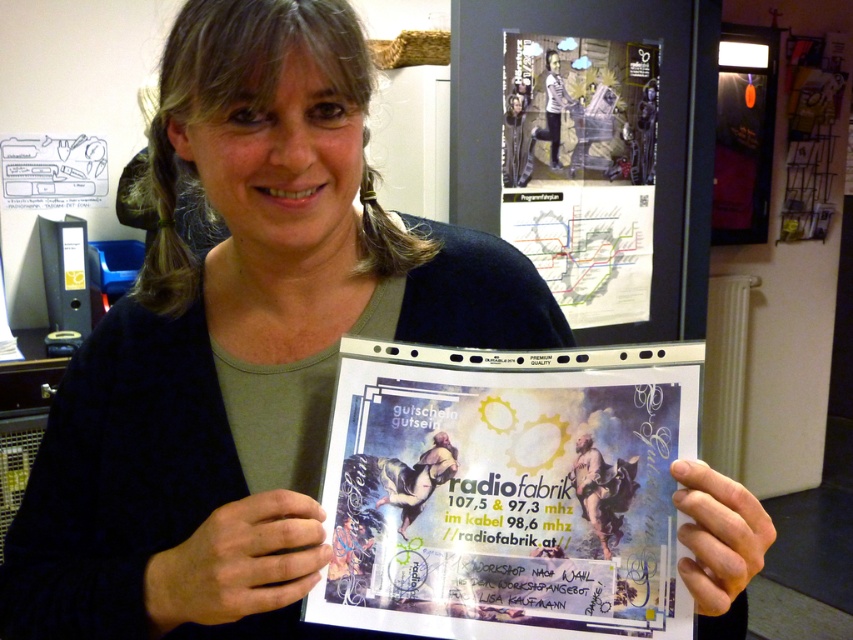
Looking at this image, you are an event planner organizing a community fair and need to hang two posters. You have a white paper poster at center and a matte paper poster at upper center. Which poster should you hang higher on the wall to match the original image?

The matte paper poster at upper center should be hung higher because it is taller than the white paper poster at center.

You are organizing a community event and need to hang two posters. The white paper poster at center and the matte paper poster at upper center must be placed on a wall. According to the scene, which poster should be placed higher up?

The matte paper poster at upper center should be placed higher up because the white paper poster at center is positioned below it in the scene.

You are an event organizer planning to hang two posters in the office. The white paper poster at center and the matte paper poster at upper center. Which poster should you choose if you want the larger one to be placed above the bulletin board?

The matte paper poster at upper center is larger than the white paper poster at center, so you should choose the matte paper poster at upper center to place above the bulletin board.